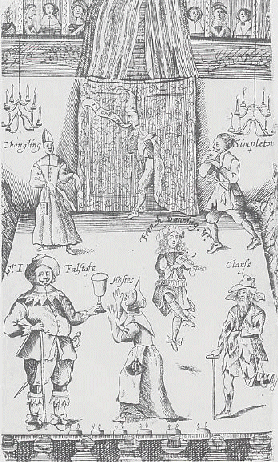
The image size is (278, 462). Identify the location of chandeliers. (254, 119), (17, 114).